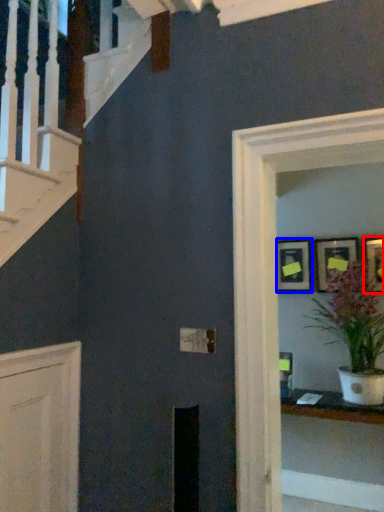
Question: Which object is closer to the camera taking this photo, picture frame (highlighted by a red box) or picture frame (highlighted by a blue box)?

Choices:
 (A) picture frame
 (B) picture frame

Answer: (A)